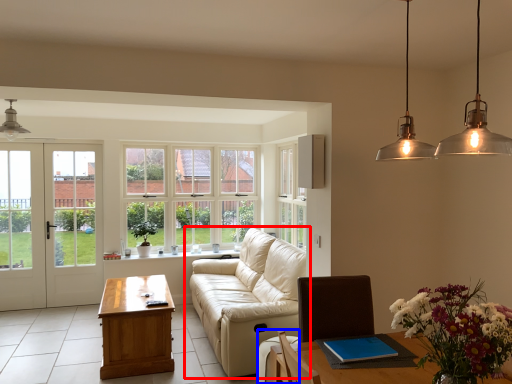
Question: Among these objects, which one is farthest to the camera, studio couch (highlighted by a red box) or armchair (highlighted by a blue box)?

Choices:
 (A) studio couch
 (B) armchair

Answer: (A)